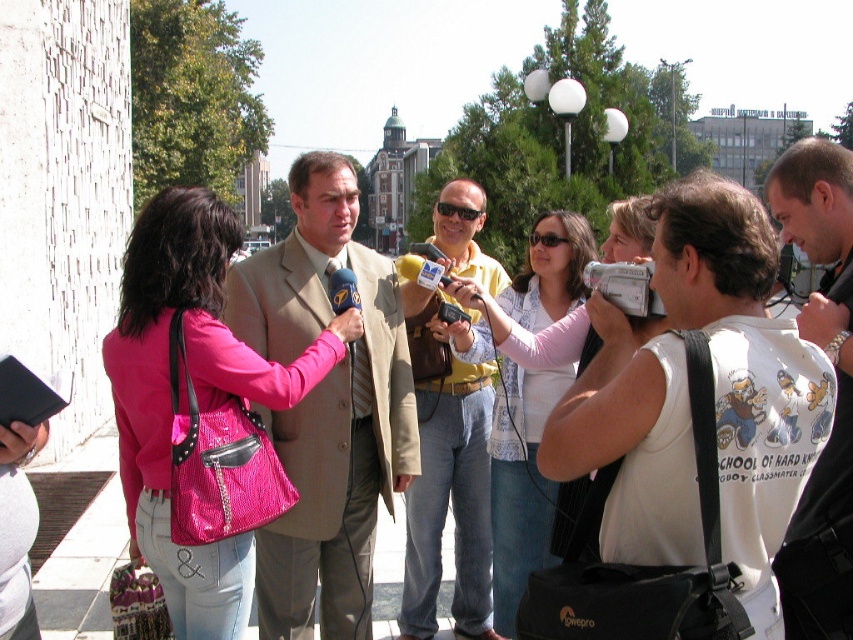
You are a photographer at the event and need to capture a closeup shot of the interviewee. The white cotton tank top at center and yellowmaterialshirt at center are both visible in the frame. Which clothing item will appear wider in your photo?

The white cotton tank top at center will appear wider in the photo because its width is larger than the yellowmaterialshirt at center according to the description.

You are a photographer at the event and want to capture a shot of both the white cotton tank top at center and the beige fabric suit at center. Which one should you focus on first if you want to include both in your frame without moving the camera?

You should focus on the beige fabric suit at center first because the white cotton tank top at center is to the right of it, so by centering the beige fabric suit, the white cotton tank top will naturally be included to its right in the frame.